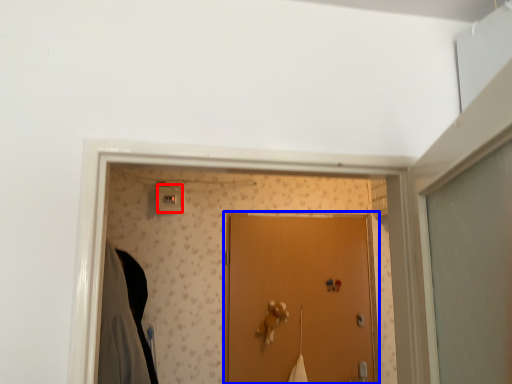
Question: Among these objects, which one is farthest to the camera, light switch (highlighted by a red box) or door (highlighted by a blue box)?

Choices:
 (A) light switch
 (B) door

Answer: (A)